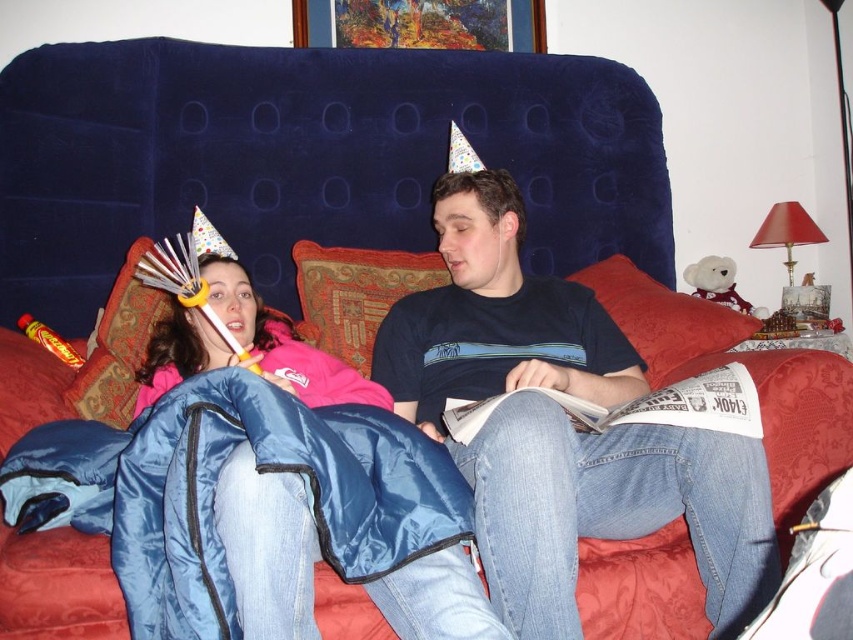
Can you confirm if blue quilted sleeping bag at left is smaller than blue synthetic sleeping bag at lower left?

Incorrect, blue quilted sleeping bag at left is not smaller in size than blue synthetic sleeping bag at lower left.

Does blue quilted sleeping bag at left have a greater height compared to blue synthetic sleeping bag at lower left?

Indeed, blue quilted sleeping bag at left has a greater height compared to blue synthetic sleeping bag at lower left.

Is point (215, 289) positioned behind point (453, 474)?

Yes, point (215, 289) is behind point (453, 474).

At what (x,y) coordinates should I click in order to perform the action: click on blue quilted sleeping bag at left. Please return your answer as a coordinate pair (x, y). This screenshot has width=853, height=640. Looking at the image, I should click on (561, 428).